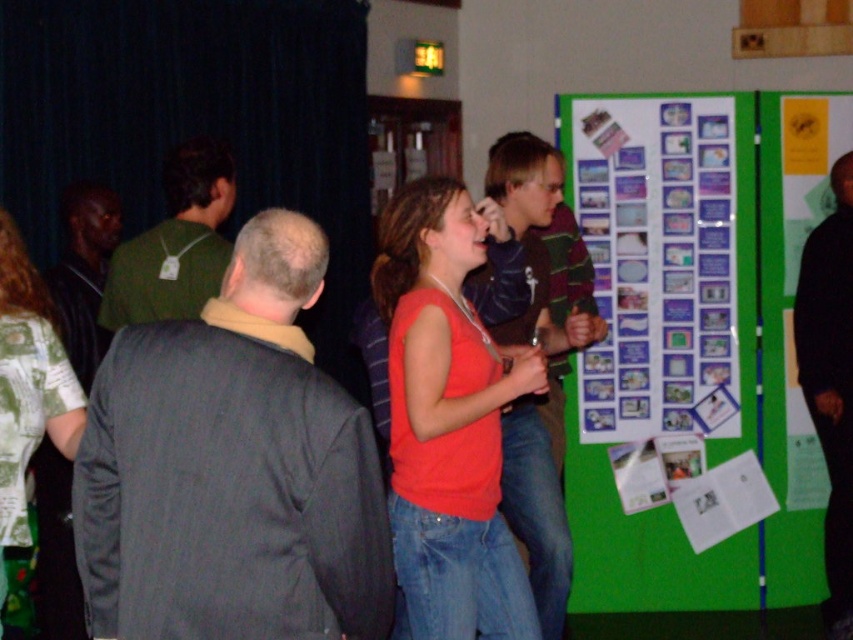
Question: Does matte orange tank top at center appear over black fabric jacket at right?

Choices:
 (A) no
 (B) yes

Answer: (B)

Question: Which of the following is the farthest from the observer?

Choices:
 (A) purple paper at center
 (B) green paperboard at right
 (C) green fabric shirt at left
 (D) dark gray jacket at center

Answer: (B)

Question: Among these objects, which one is farthest from the camera?

Choices:
 (A) purple paper at center
 (B) black fabric jacket at right

Answer: (A)

Question: Considering the real-world distances, which object is farthest from the purple paper at center?

Choices:
 (A) matte orange tank top at center
 (B) printed fabric shirt at left
 (C) green fabric shirt at left
 (D) dark gray jacket at center

Answer: (D)

Question: Does green paperboard at right have a greater width compared to printed fabric shirt at left?

Choices:
 (A) yes
 (B) no

Answer: (A)

Question: Considering the relative positions of purple paper at center and matte orange tank top at center in the image provided, where is purple paper at center located with respect to matte orange tank top at center?

Choices:
 (A) left
 (B) right

Answer: (B)